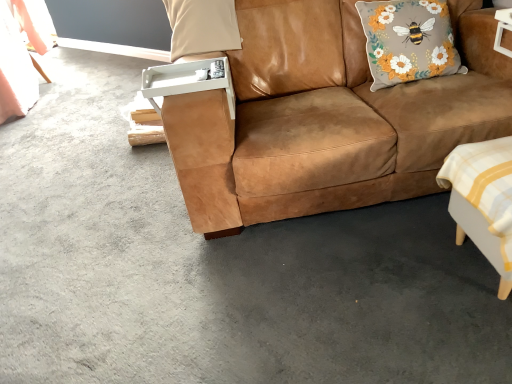
You are a GUI agent. You are given a task and a screenshot of the screen. Output one action in this format:
    pyautogui.click(x=<x>, y=<y>)
    Task: Click on the beige fabric pillow at upper center, which ranks as the second pillow in right-to-left order
    The height and width of the screenshot is (384, 512).
    Given the screenshot: What is the action you would take?
    pyautogui.click(x=202, y=26)

Between white checkered fabric swivel chair at lower right and beige fabric pillow at upper center, which ranks as the second pillow in right-to-left order, which one is positioned behind?

beige fabric pillow at upper center, which ranks as the second pillow in right-to-left order, is behind.

Is there a large distance between white checkered fabric swivel chair at lower right and beige fabric pillow at upper center, which ranks as the second pillow in right-to-left order?

Yes, white checkered fabric swivel chair at lower right and beige fabric pillow at upper center, which ranks as the second pillow in right-to-left order, are located far from each other.

From a real-world perspective, relative to beige fabric pillow at upper center, the 1th pillow positioned from the left, is white checkered fabric swivel chair at lower right vertically above or below?

white checkered fabric swivel chair at lower right is situated lower than beige fabric pillow at upper center, the 1th pillow positioned from the left, in the real world.

Measure the distance between floral fabric cushion with bee design at upper right, which ranks as the first pillow in right-to-left order, and suede brown couch at center.

The distance of floral fabric cushion with bee design at upper right, which ranks as the first pillow in right-to-left order, from suede brown couch at center is 11.49 inches.

Would you say floral fabric cushion with bee design at upper right, the 2th pillow positioned from the left, is to the left or to the right of suede brown couch at center in the picture?

In the image, floral fabric cushion with bee design at upper right, the 2th pillow positioned from the left, appears on the right side of suede brown couch at center.

Are floral fabric cushion with bee design at upper right, the 2th pillow positioned from the left, and suede brown couch at center making contact?

They are not placed beside each other.

From a real-world perspective, is floral fabric cushion with bee design at upper right, which ranks as the first pillow in right-to-left order, physically located above or below suede brown couch at center?

floral fabric cushion with bee design at upper right, which ranks as the first pillow in right-to-left order, is above suede brown couch at center.

Which object is positioned more to the right, white checkered fabric swivel chair at lower right or suede brown couch at center?

white checkered fabric swivel chair at lower right.

Is white checkered fabric swivel chair at lower right positioned behind suede brown couch at center?

No, it is in front of suede brown couch at center.

Does white checkered fabric swivel chair at lower right have a smaller size compared to suede brown couch at center?

Yes.

This screenshot has height=384, width=512. I want to click on the 2nd pillow to the left of the white checkered fabric swivel chair at lower right, starting your count from the anchor, so click(202, 26).

Is beige fabric pillow at upper center, which ranks as the second pillow in right-to-left order, oriented towards white checkered fabric swivel chair at lower right?

No, beige fabric pillow at upper center, which ranks as the second pillow in right-to-left order, is not turned towards white checkered fabric swivel chair at lower right.

Is white checkered fabric swivel chair at lower right completely or partially inside beige fabric pillow at upper center, which ranks as the second pillow in right-to-left order?

No, white checkered fabric swivel chair at lower right is not a part of beige fabric pillow at upper center, which ranks as the second pillow in right-to-left order.

How distant is beige fabric pillow at upper center, the 1th pillow positioned from the left, from white checkered fabric swivel chair at lower right?

The distance of beige fabric pillow at upper center, the 1th pillow positioned from the left, from white checkered fabric swivel chair at lower right is 1.20 meters.

Is point (330, 48) farther from camera compared to point (431, 41)?

Yes, it is.

From the image's perspective, is suede brown couch at center above or below floral fabric cushion with bee design at upper right, the 2th pillow positioned from the left?

Clearly, from the image's perspective, suede brown couch at center is below floral fabric cushion with bee design at upper right, the 2th pillow positioned from the left.

Is suede brown couch at center thinner than floral fabric cushion with bee design at upper right, which ranks as the first pillow in right-to-left order?

In fact, suede brown couch at center might be wider than floral fabric cushion with bee design at upper right, which ranks as the first pillow in right-to-left order.

Considering the positions of objects suede brown couch at center and beige fabric pillow at upper center, which ranks as the second pillow in right-to-left order, in the image provided, who is more to the left, suede brown couch at center or beige fabric pillow at upper center, which ranks as the second pillow in right-to-left order,?

beige fabric pillow at upper center, which ranks as the second pillow in right-to-left order.

In the scene shown: From the image's perspective, between suede brown couch at center and beige fabric pillow at upper center, which ranks as the second pillow in right-to-left order, which one is located above?

beige fabric pillow at upper center, which ranks as the second pillow in right-to-left order, is shown above in the image.

Does point (312, 34) come behind point (201, 18)?

Yes, point (312, 34) is farther from viewer.

From the image's perspective, which is above, beige fabric pillow at upper center, which ranks as the second pillow in right-to-left order, or suede brown couch at center?

beige fabric pillow at upper center, which ranks as the second pillow in right-to-left order, appears higher in the image.

Is beige fabric pillow at upper center, which ranks as the second pillow in right-to-left order, inside or outside of suede brown couch at center?

beige fabric pillow at upper center, which ranks as the second pillow in right-to-left order, is inside suede brown couch at center.

Between point (226, 50) and point (402, 106), which one is positioned in front?

The point (402, 106) is closer.

Considering the relative sizes of beige fabric pillow at upper center, which ranks as the second pillow in right-to-left order, and suede brown couch at center in the image provided, is beige fabric pillow at upper center, which ranks as the second pillow in right-to-left order, thinner than suede brown couch at center?

Correct, the width of beige fabric pillow at upper center, which ranks as the second pillow in right-to-left order, is less than that of suede brown couch at center.

What are the coordinates of `pillow that is the 2nd one when counting leftward from the white checkered fabric swivel chair at lower right` in the screenshot? It's located at (202, 26).

The width and height of the screenshot is (512, 384). I want to click on pillow that is the 1st one above the suede brown couch at center (from a real-world perspective), so click(408, 41).

From the image, which object appears to be nearer to white checkered fabric swivel chair at lower right, floral fabric cushion with bee design at upper right, which ranks as the first pillow in right-to-left order, or beige fabric pillow at upper center, which ranks as the second pillow in right-to-left order?

floral fabric cushion with bee design at upper right, which ranks as the first pillow in right-to-left order.

When comparing their distances from floral fabric cushion with bee design at upper right, the 2th pillow positioned from the left, does white checkered fabric swivel chair at lower right or beige fabric pillow at upper center, the 1th pillow positioned from the left, seem further?

The object further to floral fabric cushion with bee design at upper right, the 2th pillow positioned from the left, is beige fabric pillow at upper center, the 1th pillow positioned from the left.

Based on their spatial positions, is floral fabric cushion with bee design at upper right, the 2th pillow positioned from the left, or white checkered fabric swivel chair at lower right closer to suede brown couch at center?

Among the two, floral fabric cushion with bee design at upper right, the 2th pillow positioned from the left, is located nearer to suede brown couch at center.

Which object lies further to the anchor point white checkered fabric swivel chair at lower right, beige fabric pillow at upper center, which ranks as the second pillow in right-to-left order, or floral fabric cushion with bee design at upper right, which ranks as the first pillow in right-to-left order?

beige fabric pillow at upper center, which ranks as the second pillow in right-to-left order.

From the image, which object appears to be nearer to floral fabric cushion with bee design at upper right, which ranks as the first pillow in right-to-left order, suede brown couch at center or beige fabric pillow at upper center, the 1th pillow positioned from the left?

suede brown couch at center is positioned closer to the anchor floral fabric cushion with bee design at upper right, which ranks as the first pillow in right-to-left order.

Considering their positions, is beige fabric pillow at upper center, the 1th pillow positioned from the left, positioned closer to floral fabric cushion with bee design at upper right, which ranks as the first pillow in right-to-left order, than suede brown couch at center?

Based on the image, suede brown couch at center appears to be nearer to floral fabric cushion with bee design at upper right, which ranks as the first pillow in right-to-left order.

Looking at the image, which one is located closer to suede brown couch at center, beige fabric pillow at upper center, the 1th pillow positioned from the left, or floral fabric cushion with bee design at upper right, which ranks as the first pillow in right-to-left order?

floral fabric cushion with bee design at upper right, which ranks as the first pillow in right-to-left order, lies closer to suede brown couch at center than the other object.

When comparing their distances from suede brown couch at center, does beige fabric pillow at upper center, the 1th pillow positioned from the left, or white checkered fabric swivel chair at lower right seem further?

beige fabric pillow at upper center, the 1th pillow positioned from the left, lies further to suede brown couch at center than the other object.

Identify the location of studio couch located between beige fabric pillow at upper center, which ranks as the second pillow in right-to-left order, and white checkered fabric swivel chair at lower right in the left-right direction. tap(327, 117).

Locate an element on the screen. The height and width of the screenshot is (384, 512). pillow between beige fabric pillow at upper center, which ranks as the second pillow in right-to-left order, and white checkered fabric swivel chair at lower right, in the horizontal direction is located at coordinates (408, 41).

In order to click on studio couch between floral fabric cushion with bee design at upper right, the 2th pillow positioned from the left, and white checkered fabric swivel chair at lower right vertically in this screenshot , I will do click(327, 117).

Find the location of a particular element. Image resolution: width=512 pixels, height=384 pixels. studio couch between beige fabric pillow at upper center, which ranks as the second pillow in right-to-left order, and floral fabric cushion with bee design at upper right, the 2th pillow positioned from the left, in the horizontal direction is located at coordinates (327, 117).